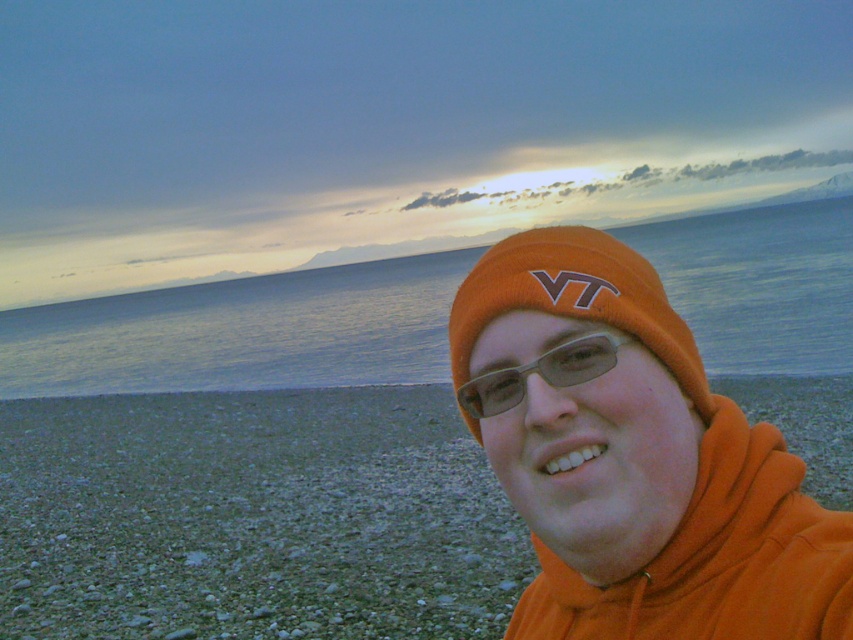
You are a photographer trying to capture the sunset reflection on the water. You have two orange items in your bag, the orange fabric at lower right and the orange fleece at center. Which item should you use to cover your camera to protect it from the sand, considering the size of the items?

The orange fabric at lower right is larger in size than the orange fleece at center, so you should use the orange fabric at lower right to cover your camera as it provides better coverage against the sand.

You are a photographer trying to capture both the orange fleece at center and the orange knit beanie at center in a single frame. Which object should you position closer to the center of your camera frame to ensure both fit without cropping?

Since the orange fleece at center is wider than the orange knit beanie at center, you should position the orange fleece at center closer to the center of your camera frame to accommodate its larger width, ensuring both objects fit within the frame without cropping.